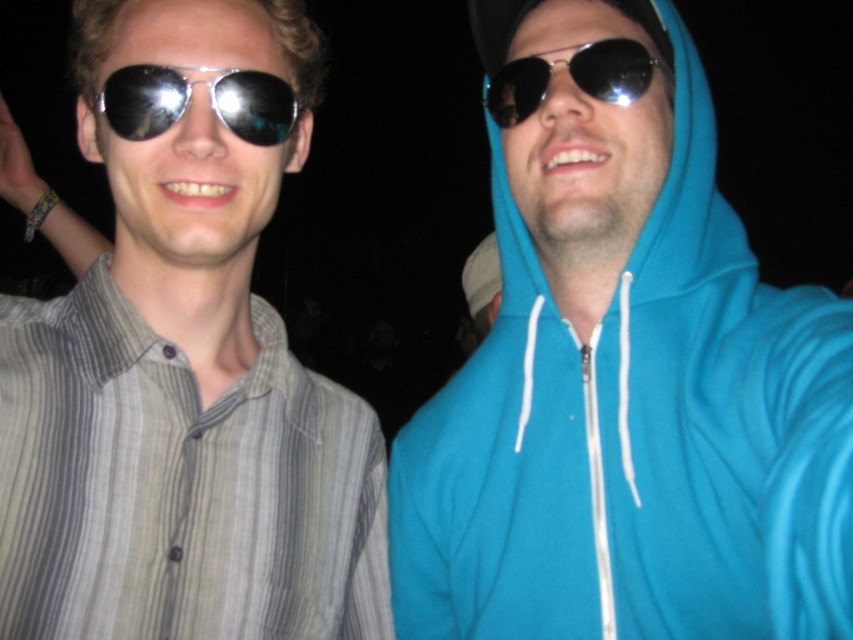
Based on the photo, you are holding a camera and want to take a photo of the two people in the scene. The camera has a focus range of 25 to 35 inches. Will the point at point (595,10) be within the focus range?

The distance of point (595,10) from the camera is 30.01 inches, which falls within the focus range of 25 to 35 inches. Therefore, the point will be within the focus range.

You are a photographer trying to capture a closeup of the striped cotton shirt at left. Given that your camera can focus on objects within 25 inches, will you need to move closer or farther away to get a clear shot?

The striped cotton shirt at left is 26.26 inches from viewer. Since your camera focuses within 25 inches, you need to move closer to get a clear shot.

You are a photographer adjusting the framing of a portrait. You notice the teal fleece hoodie at center and the metallic reflective sunglasses at center in the shot. Given that the minimum focus distance for your camera is 8 inches, will both items be in focus if they are currently 8.54 inches apart?

The teal fleece hoodie at center and metallic reflective sunglasses at center are 8.54 inches apart, which exceeds the camera minimum focus distance of 8 inches. Therefore, both items will be in focus.